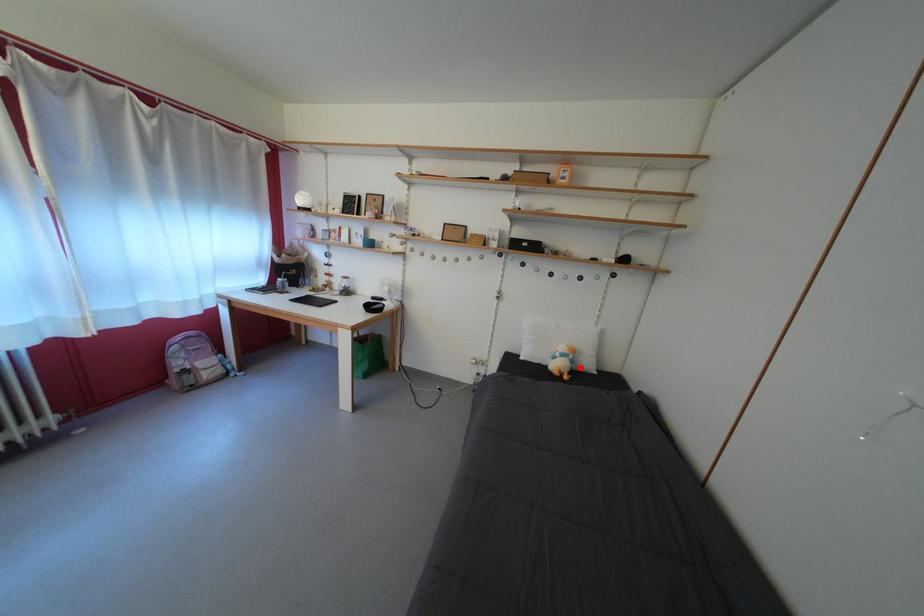
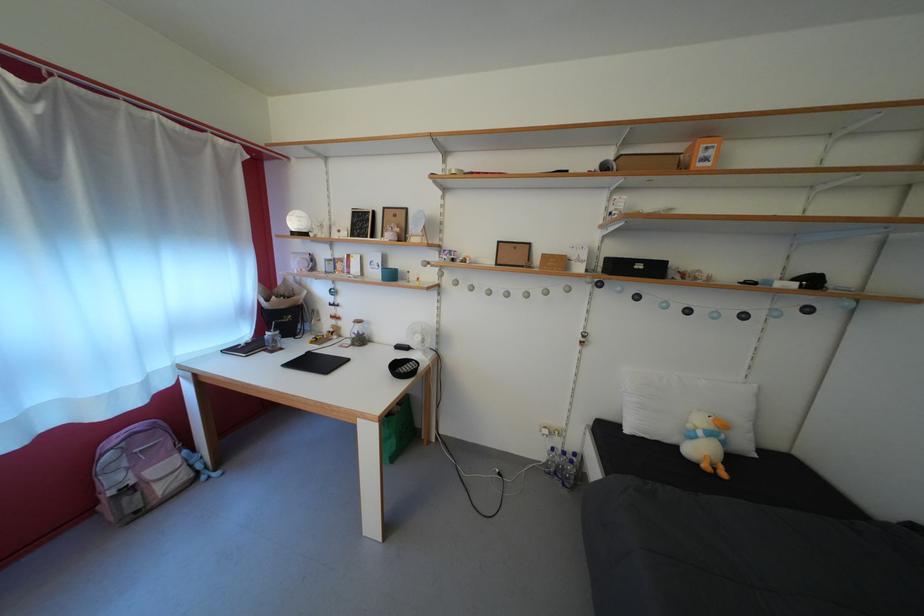
The point at the highlighted location is marked in the first image. Where is the corresponding point in the second image?

(732, 448)